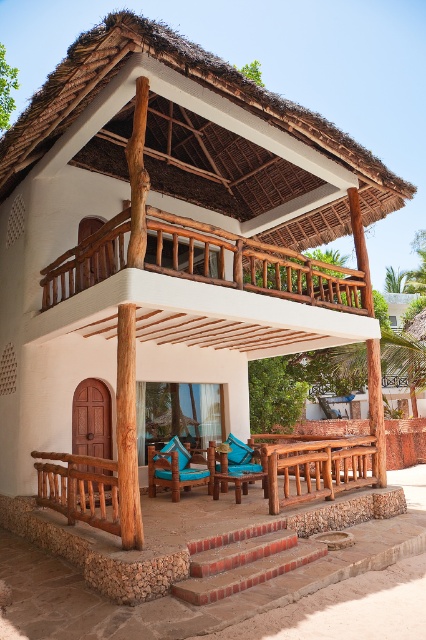
You are standing at the entrance of the house and want to walk towards the point labeled as point (276, 531). There is another point marked as point (204, 236) in the scene. Which point will you encounter first while moving forward?

You will encounter point (276, 531) first because it is in front of point (204, 236), which is located behind it according to their positions.

You are planning to place a 1.5 meter wide flower pot on the lower center area of the house. Given the presence of the brick stairs at lower center and the brown wooden bench at lower center, which object would you need to move to accommodate the flower pot?

The brick stairs at lower center has a smaller width compared to the brown wooden bench at lower center. Therefore, you would need to move the brick stairs at lower center to make space for the flower pot.